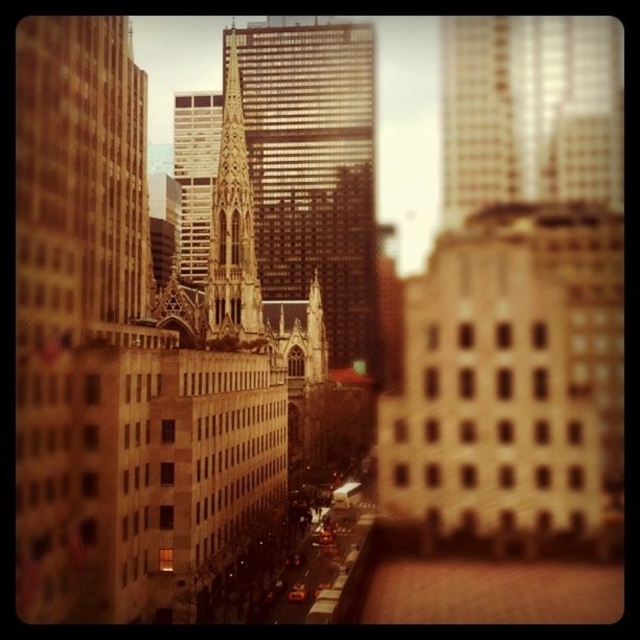
Question: Does golden stone cathedral at center come behind greenish-golden stone spire at center?

Choices:
 (A) yes
 (B) no

Answer: (A)

Question: Which object is closer to the camera taking this photo?

Choices:
 (A) greenish-golden stone spire at center
 (B) smooth glass skyscraper at upper center

Answer: (A)

Question: Which point appears closest to the camera in this image?

Choices:
 (A) coord(472,182)
 (B) coord(244,304)
 (C) coord(340,273)

Answer: (B)

Question: Is smooth glass skyscraper at upper center below greenish-golden stone spire at center?

Choices:
 (A) no
 (B) yes

Answer: (A)

Question: Which of the following is the farthest from the observer?

Choices:
 (A) (444, 204)
 (B) (212, 196)
 (C) (333, 81)

Answer: (A)

Question: Observing the image, what is the correct spatial positioning of golden stone cathedral at center in reference to smooth glass skyscraper at upper center?

Choices:
 (A) left
 (B) right

Answer: (A)